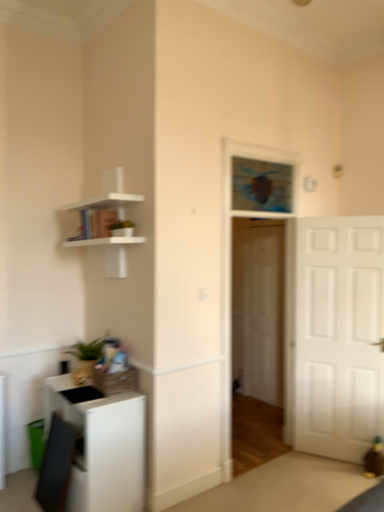
The image size is (384, 512). Find the location of `vacant region below white matte door at right, which is the second door in back-to-front order (from a real-world perspective)`. vacant region below white matte door at right, which is the second door in back-to-front order (from a real-world perspective) is located at coordinates (328, 462).